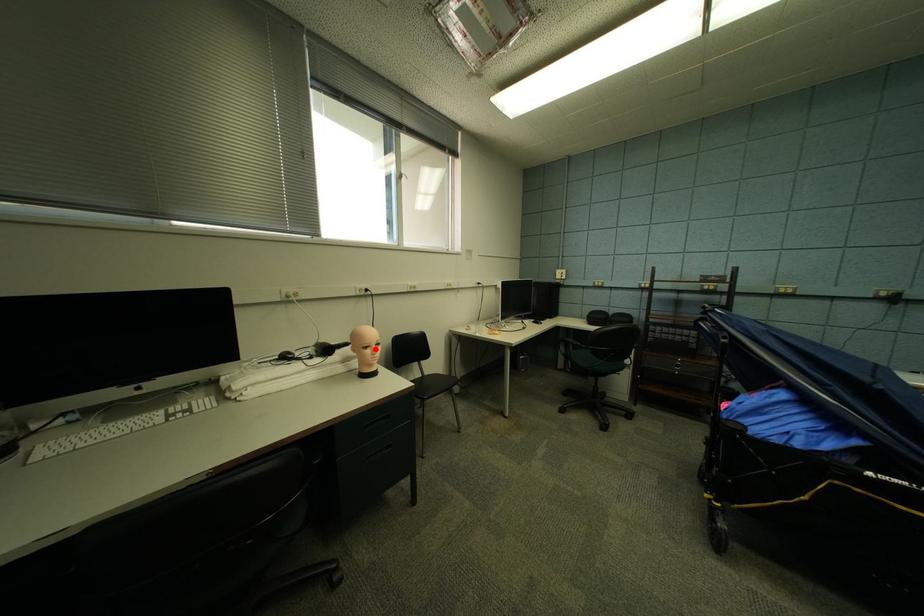
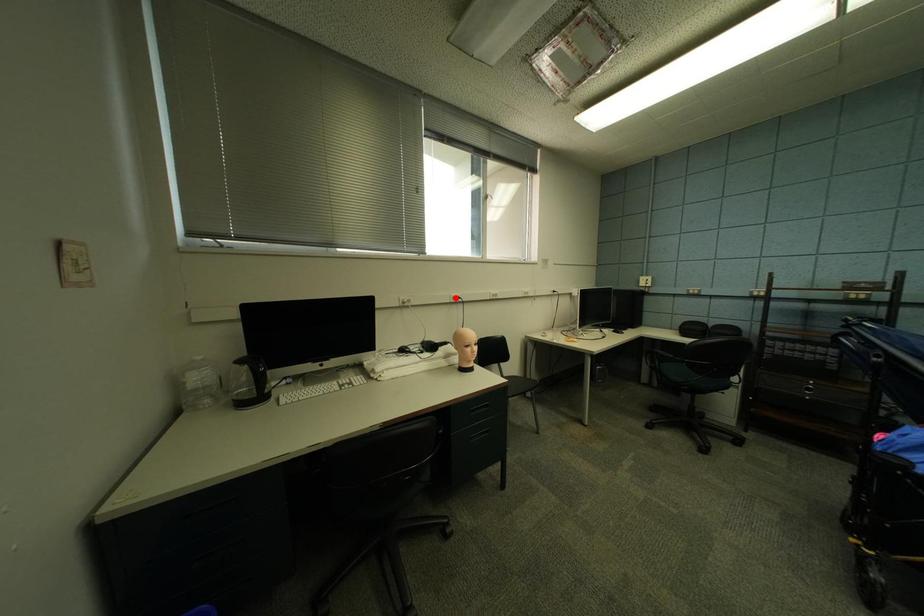
Based on the photo, I am providing you with two images of the same scene from different viewpoints. A red point is marked on the first image and another point is marked on the second image. Is the marked point in image1 the same physical position as the marked point in image2?

No